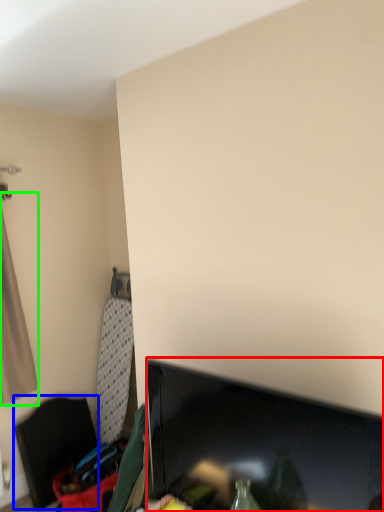
Question: Which object is positioned farthest from television (highlighted by a red box)? Select from furniture (highlighted by a blue box) and curtain (highlighted by a green box).

Choices:
 (A) furniture
 (B) curtain

Answer: (B)